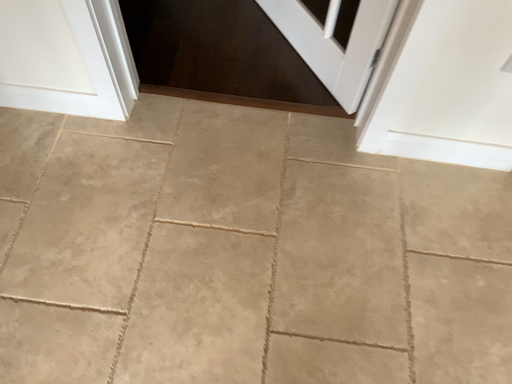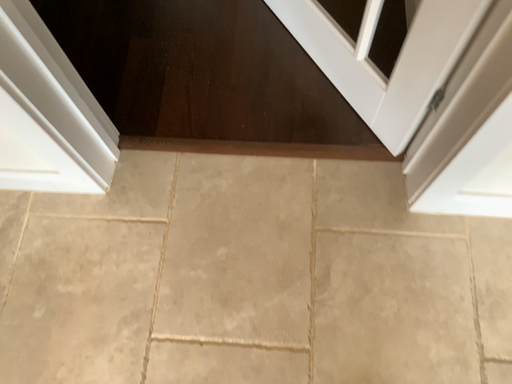
Question: Which way did the camera rotate in the video?

Choices:
 (A) rotated downward
 (B) rotated upward

Answer: (A)